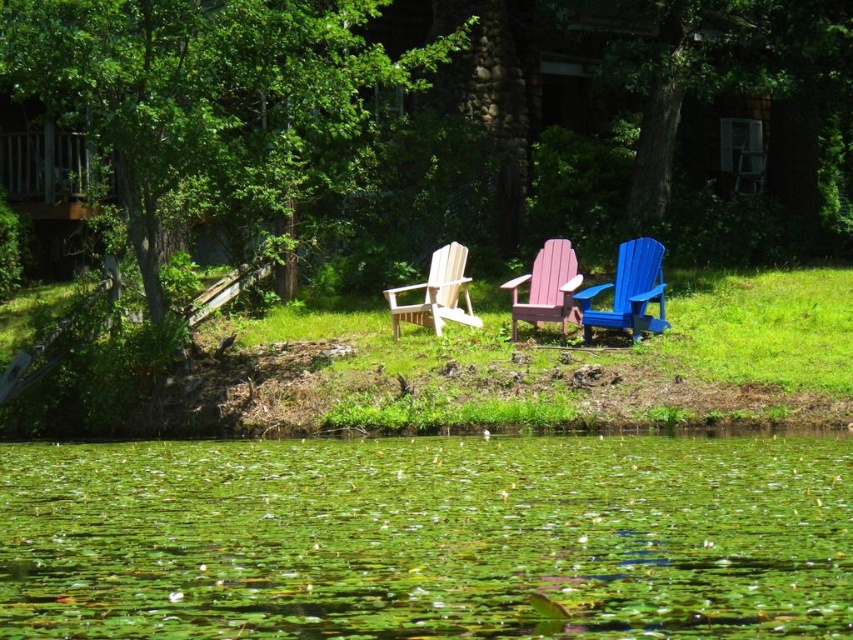
Can you confirm if blue plastic beach chair at center is smaller than light wood beach chair at center?

Indeed, blue plastic beach chair at center has a smaller size compared to light wood beach chair at center.

Is point (637, 332) positioned after point (454, 310)?

No, (637, 332) is in front of (454, 310).

Does point (648, 324) come behind point (431, 288)?

No.

You are a GUI agent. You are given a task and a screenshot of the screen. Output one action in this format:
    pyautogui.click(x=<x>, y=<y>)
    Task: Click on the blue plastic beach chair at center
    This screenshot has height=640, width=853.
    Given the screenshot: What is the action you would take?
    pyautogui.click(x=628, y=292)

Looking at this image, is green leafy water at lower center above pink wood beach chair at center?

Actually, green leafy water at lower center is below pink wood beach chair at center.

Between green leafy water at lower center and pink wood beach chair at center, which one has less height?

green leafy water at lower center

You are a GUI agent. You are given a task and a screenshot of the screen. Output one action in this format:
    pyautogui.click(x=<x>, y=<y>)
    Task: Click on the green leafy water at lower center
    
    Given the screenshot: What is the action you would take?
    pyautogui.click(x=427, y=538)

Between green leafy water at lower center and light wood beach chair at center, which one is positioned lower?

green leafy water at lower center is below.

Looking at this image, between green leafy water at lower center and light wood beach chair at center, which one has less height?

green leafy water at lower center

Between point (103, 557) and point (479, 317), which one is positioned in front?

Point (103, 557) is in front.

Locate an element on the screen. The width and height of the screenshot is (853, 640). green leafy water at lower center is located at coordinates (427, 538).